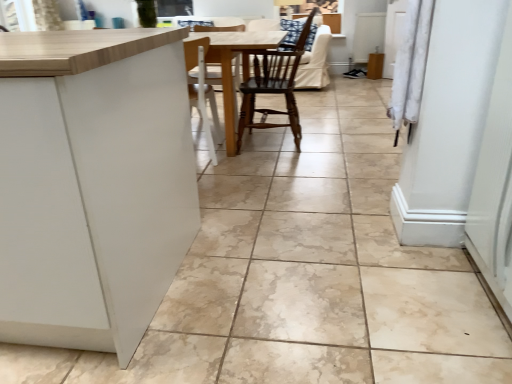
This screenshot has height=384, width=512. I want to click on free space in front of wooden chair at center, so click(272, 168).